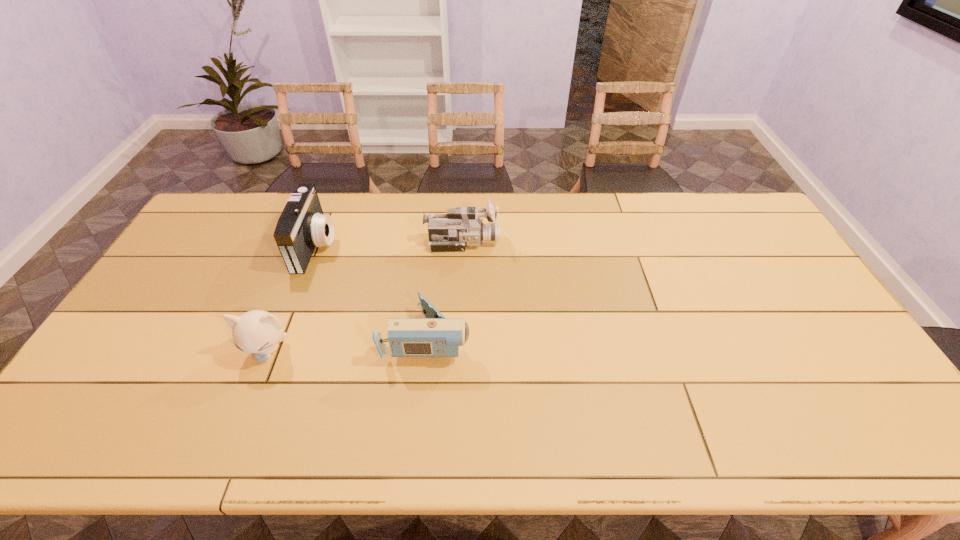
In order to click on free point between the kitten and the leftmost camcorder in this screenshot , I will do `click(292, 298)`.

You are a GUI agent. You are given a task and a screenshot of the screen. Output one action in this format:
    pyautogui.click(x=<x>, y=<y>)
    Task: Click on the free spot between the nearest camcorder and the leftmost camcorder
    
    Given the screenshot: What is the action you would take?
    pyautogui.click(x=372, y=291)

The width and height of the screenshot is (960, 540). I want to click on free spot between the kitten and the shortest camcorder, so click(x=348, y=343).

Where is `vacant region between the nearest camcorder and the leftmost camcorder`? This screenshot has height=540, width=960. vacant region between the nearest camcorder and the leftmost camcorder is located at coordinates (372, 291).

This screenshot has width=960, height=540. I want to click on empty space between the shortest camcorder and the leftmost camcorder, so click(x=372, y=291).

Where is `unoccupied position between the kitten and the nearest camcorder`? unoccupied position between the kitten and the nearest camcorder is located at coordinates tap(348, 343).

At what (x,y) coordinates should I click in order to perform the action: click on vacant space in between the leftmost camcorder and the kitten. Please return your answer as a coordinate pair (x, y). The image size is (960, 540). Looking at the image, I should click on (292, 298).

Where is `object that is the second nearest to the nearest camcorder`? The height and width of the screenshot is (540, 960). object that is the second nearest to the nearest camcorder is located at coordinates (461, 227).

At what (x,y) coordinates should I click in order to perform the action: click on object that stands as the third closest to the kitten. Please return your answer as a coordinate pair (x, y). Looking at the image, I should click on pos(461,227).

At what (x,y) coordinates should I click in order to perform the action: click on the second closest camcorder to the leftmost camcorder. Please return your answer as a coordinate pair (x, y). Image resolution: width=960 pixels, height=540 pixels. Looking at the image, I should click on (461, 227).